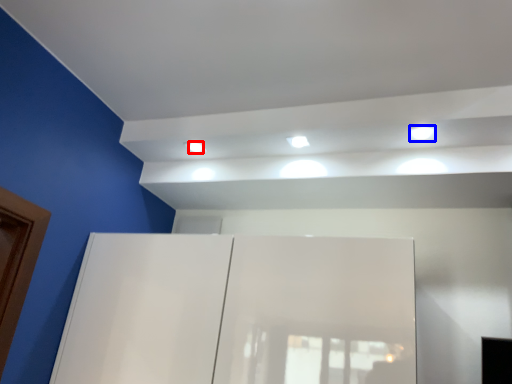
Question: Which of the following is the closest to the observer, dot (highlighted by a red box) or light (highlighted by a blue box)?

Choices:
 (A) dot
 (B) light

Answer: (B)